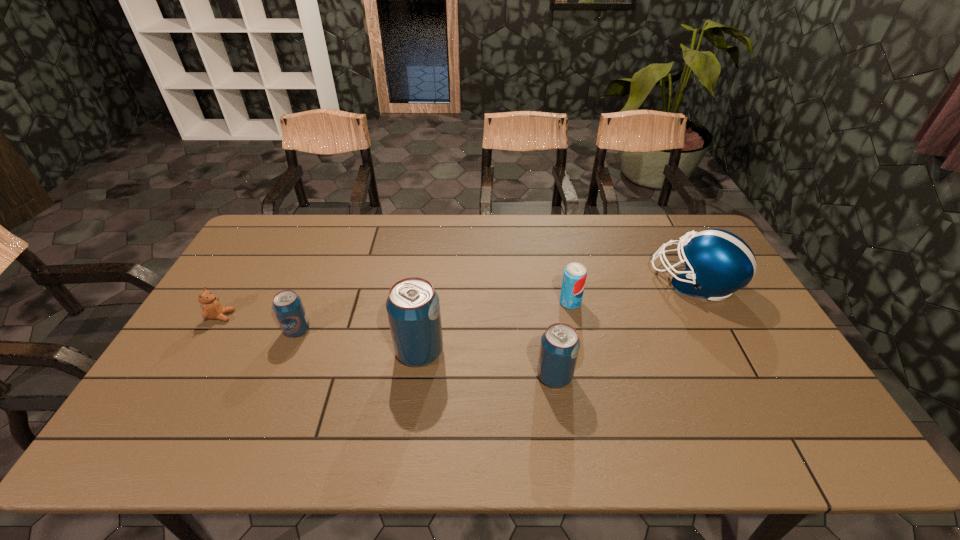
Identify the location of vacant region that satisfies the following two spatial constraints: 1. on the face of the third object from right to left; 2. on the left side of the shortest object. (186, 376).

What are the coordinates of `free spot that satisfies the following two spatial constraints: 1. on the back side of the third soda can from left to right; 2. on the right side of the second object from right to left` in the screenshot? It's located at (543, 302).

The image size is (960, 540). I want to click on free space that satisfies the following two spatial constraints: 1. on the face of the shortest object; 2. on the right side of the second soda can from left to right, so click(x=200, y=352).